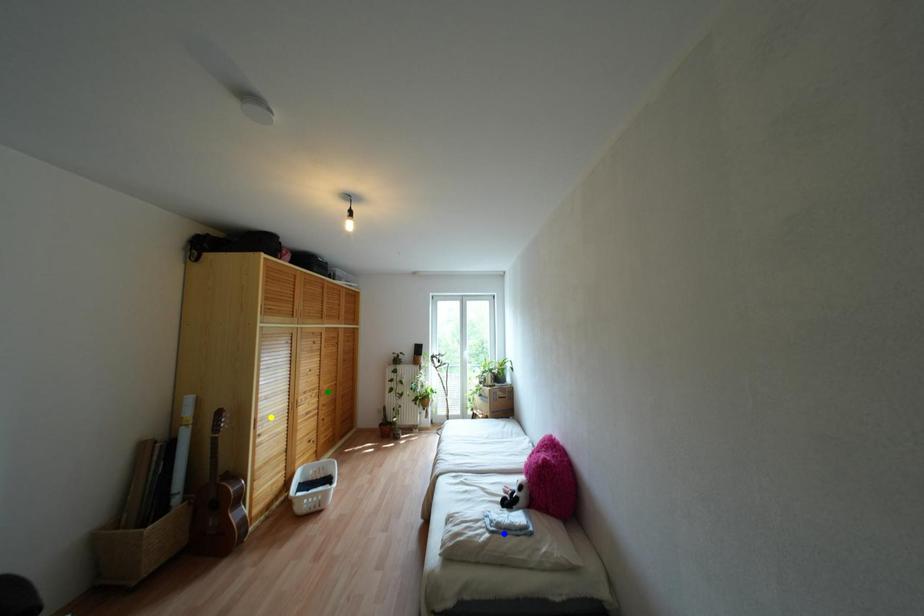
Order these from nearest to farthest:
blue point | yellow point | green point

1. blue point
2. yellow point
3. green point